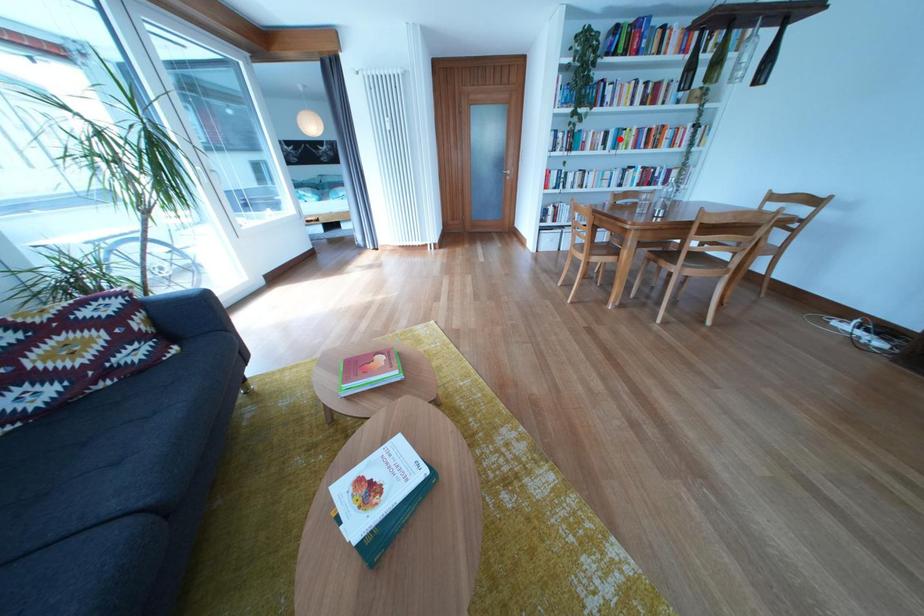
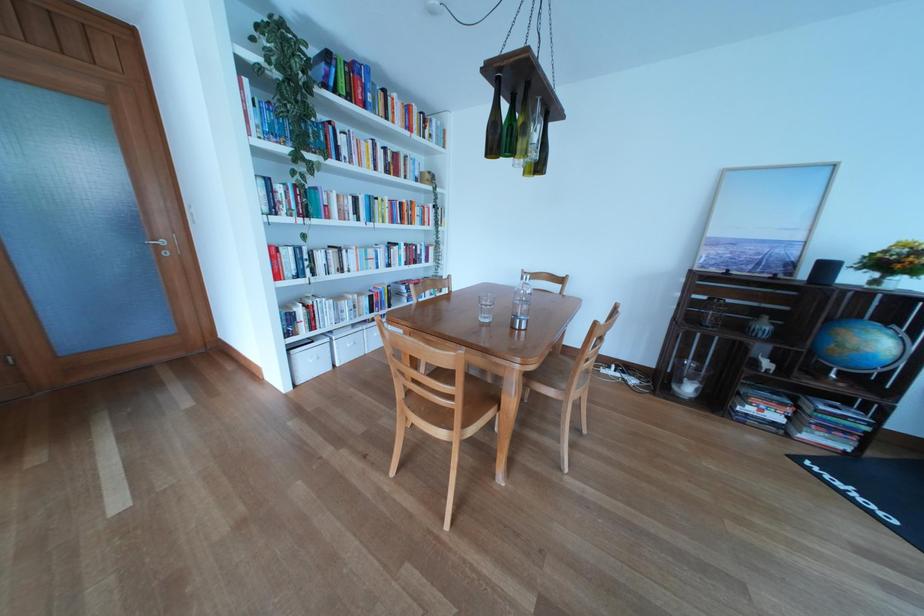
Find the pixel in the second image that matches the highlighted location in the first image.

(369, 206)